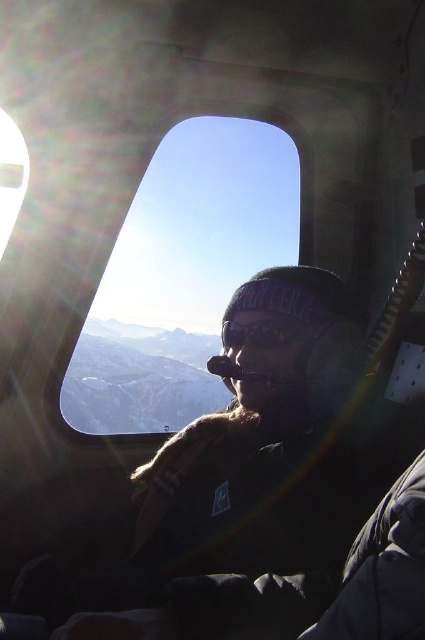
Is transparent glass window at center positioned behind matte black goggles at center?

Yes.

Is transparent glass window at center to the right of matte black goggles at center from the viewer's perspective?

In fact, transparent glass window at center is to the left of matte black goggles at center.

The width and height of the screenshot is (425, 640). Describe the element at coordinates (181, 275) in the screenshot. I see `transparent glass window at center` at that location.

This screenshot has height=640, width=425. Find the location of `transparent glass window at center`. transparent glass window at center is located at coordinates (181, 275).